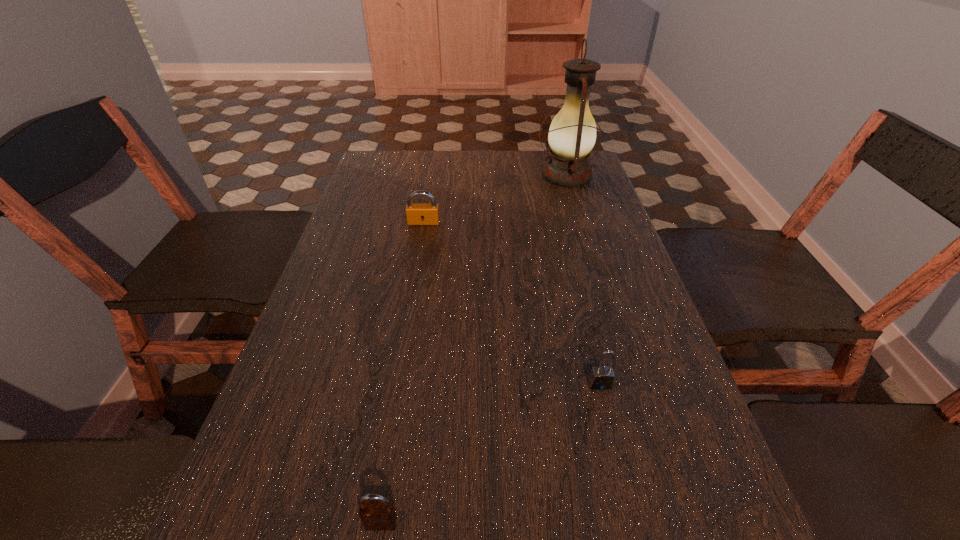
The height and width of the screenshot is (540, 960). What are the coordinates of `oil lamp at the right edge` in the screenshot? It's located at (572, 134).

Identify the location of padlock situated at the right edge. (602, 377).

Image resolution: width=960 pixels, height=540 pixels. Find the location of `object located in the far right corner section of the desktop`. object located in the far right corner section of the desktop is located at coordinates (572, 134).

The width and height of the screenshot is (960, 540). What are the coordinates of `free region at the far edge of the desktop` in the screenshot? It's located at (478, 160).

Identify the location of free region at the left edge. (278, 460).

Find the location of a particular element. The height and width of the screenshot is (540, 960). vacant space at the right edge of the desktop is located at coordinates (611, 235).

The width and height of the screenshot is (960, 540). Find the location of `free space at the far left corner`. free space at the far left corner is located at coordinates (359, 181).

This screenshot has width=960, height=540. I want to click on free space between the nearest object and the second nearest padlock, so click(491, 454).

Where is `free space between the second nearest object and the tallest object`? This screenshot has height=540, width=960. free space between the second nearest object and the tallest object is located at coordinates (583, 280).

Locate an element on the screen. This screenshot has width=960, height=540. free space between the second nearest padlock and the third nearest object is located at coordinates (512, 303).